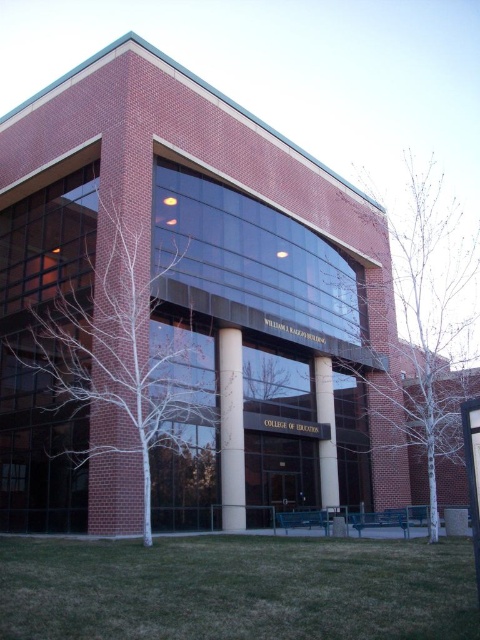
This screenshot has height=640, width=480. I want to click on bare branches at right, so click(429, 323).

What are the coordinates of `bare branches at right` in the screenshot? It's located at (429, 323).

Can you confirm if green grass at lower center is smaller than bare branches at center?

No, green grass at lower center is not smaller than bare branches at center.

Between point (170, 595) and point (302, 376), which one is positioned behind?

Positioned behind is point (302, 376).

Where is `green grass at lower center`? green grass at lower center is located at coordinates (237, 588).

Does white bark tree at center have a smaller size compared to bare branches at right?

Yes.

In the scene shown: Who is more forward, [127,438] or [471,339]?

Point [127,438]

Is point (37, 224) behind point (396, 269)?

No.

The height and width of the screenshot is (640, 480). I want to click on white bark tree at center, so click(x=104, y=342).